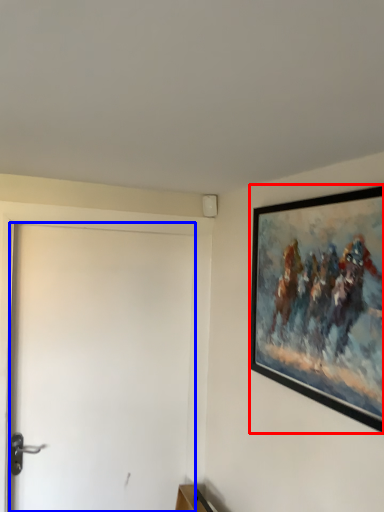
Question: Which of the following is the farthest to the observer, picture frame (highlighted by a red box) or door (highlighted by a blue box)?

Choices:
 (A) picture frame
 (B) door

Answer: (B)